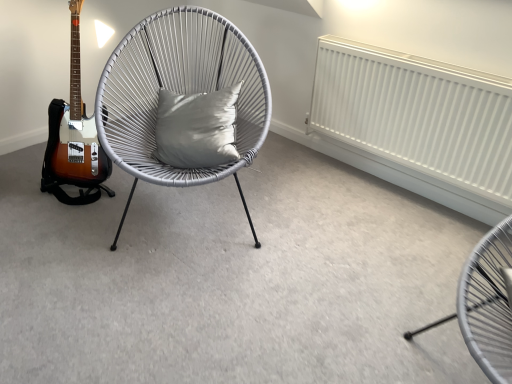
Locate an element on the screen. free spot to the right of white woven chair at center, which is the first chair in back-to-front order is located at coordinates (332, 221).